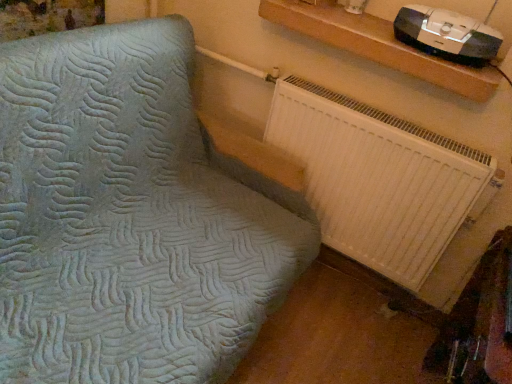
Question: Considering the positions of wooden shelf at upper right and black plastic stereo at upper right in the image, is wooden shelf at upper right bigger or smaller than black plastic stereo at upper right?

Choices:
 (A) small
 (B) big

Answer: (B)

Question: Does point (474, 72) appear closer or farther from the camera than point (439, 36)?

Choices:
 (A) farther
 (B) closer

Answer: (B)

Question: Considering the real-world distances, which object is closest to the white plastic radiator at lower right?

Choices:
 (A) black plastic stereo at upper right
 (B) wooden shelf at upper right

Answer: (B)

Question: Estimate the real-world distances between objects in this image. Which object is closer to the white plastic radiator at lower right?

Choices:
 (A) wooden shelf at upper right
 (B) black plastic stereo at upper right

Answer: (A)